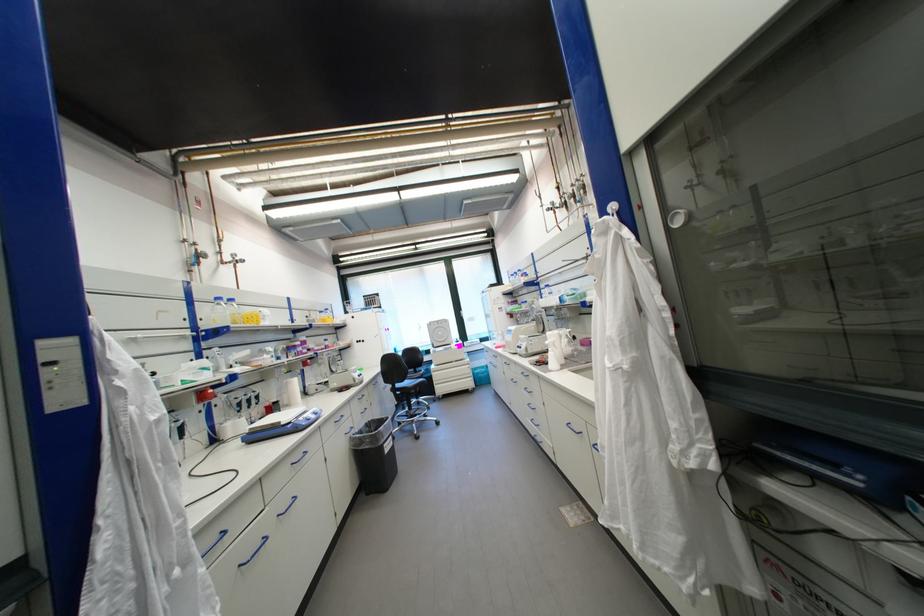
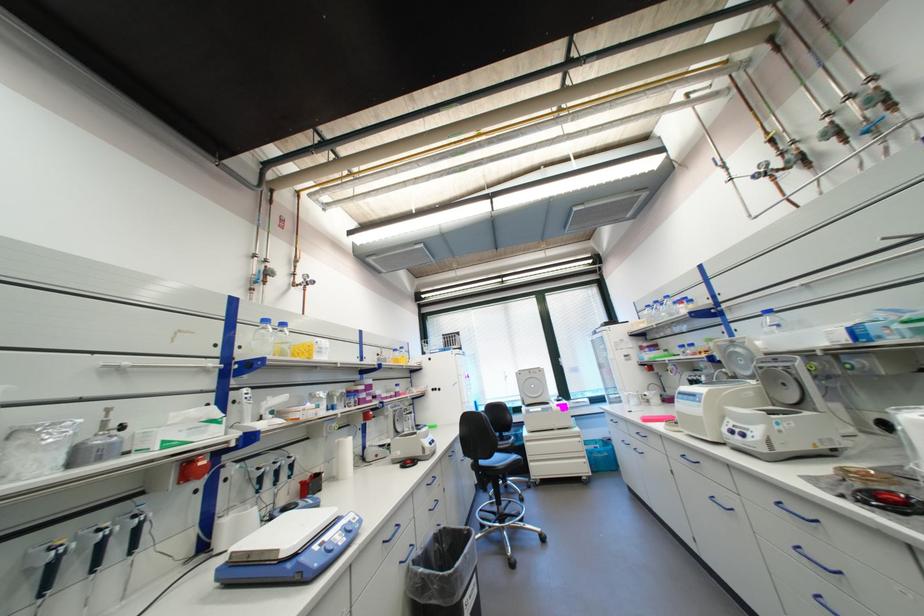
Where in the second image is the point corresponding to pixel 520 276 from the first image?

(655, 307)